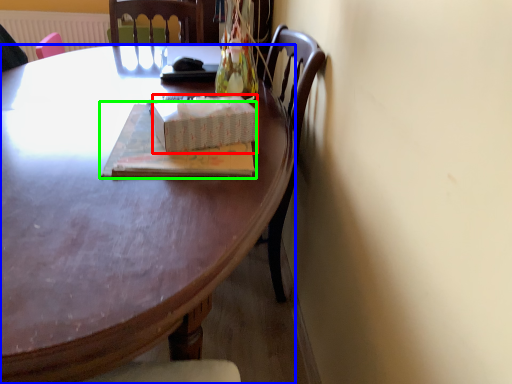
Question: Estimate the real-world distances between objects in this image. Which object is farther from box (highlighted by a red box), desk (highlighted by a blue box) or book (highlighted by a green box)?

Choices:
 (A) desk
 (B) book

Answer: (A)